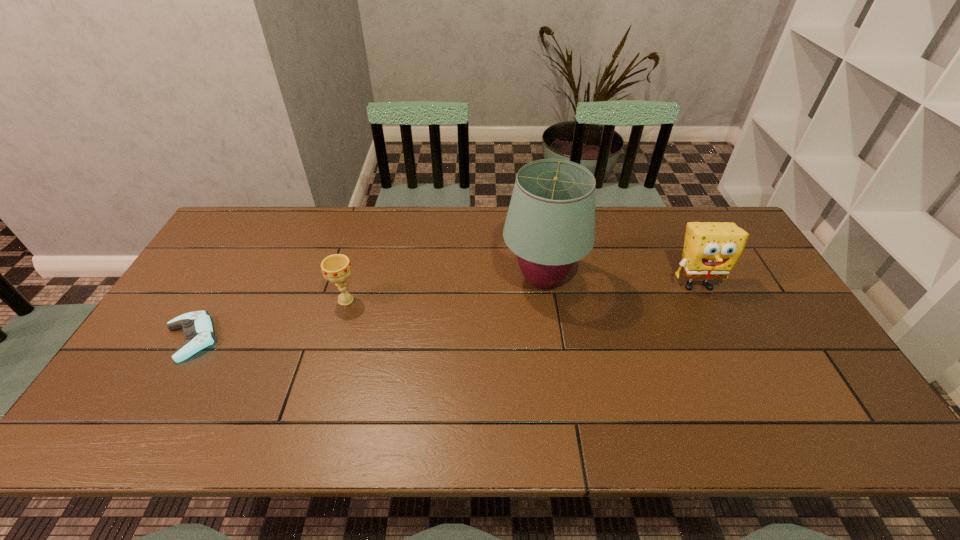
The height and width of the screenshot is (540, 960). I want to click on free space that is in between the nearest object and the tallest object, so click(367, 309).

Image resolution: width=960 pixels, height=540 pixels. What are the coordinates of `vacant area between the second shortest object and the second tallest object` in the screenshot? It's located at (521, 292).

You are a GUI agent. You are given a task and a screenshot of the screen. Output one action in this format:
    pyautogui.click(x=<x>, y=<y>)
    Task: Click on the free point between the second tallest object and the second object from right to left
    The width and height of the screenshot is (960, 540).
    Given the screenshot: What is the action you would take?
    point(620,282)

This screenshot has height=540, width=960. What are the coordinates of `unoccupied area between the leftmost object and the sponge` in the screenshot? It's located at (444, 312).

Where is `free space between the nearest object and the chalice`? free space between the nearest object and the chalice is located at coordinates (269, 320).

Find the location of a particular element. The image size is (960, 540). vacant space that's between the second shortest object and the third object from left to right is located at coordinates (444, 290).

Locate an element on the screen. This screenshot has height=540, width=960. vacant area that lies between the lampshade and the second object from left to right is located at coordinates (444, 290).

The height and width of the screenshot is (540, 960). In order to click on unoccupied position between the third object from right to left and the sponge in this screenshot , I will do `click(521, 292)`.

The height and width of the screenshot is (540, 960). I want to click on vacant space that's between the third object from right to left and the third shortest object, so click(x=521, y=292).

Image resolution: width=960 pixels, height=540 pixels. In order to click on object that is the closest to the leftmost object in this screenshot , I will do `click(336, 268)`.